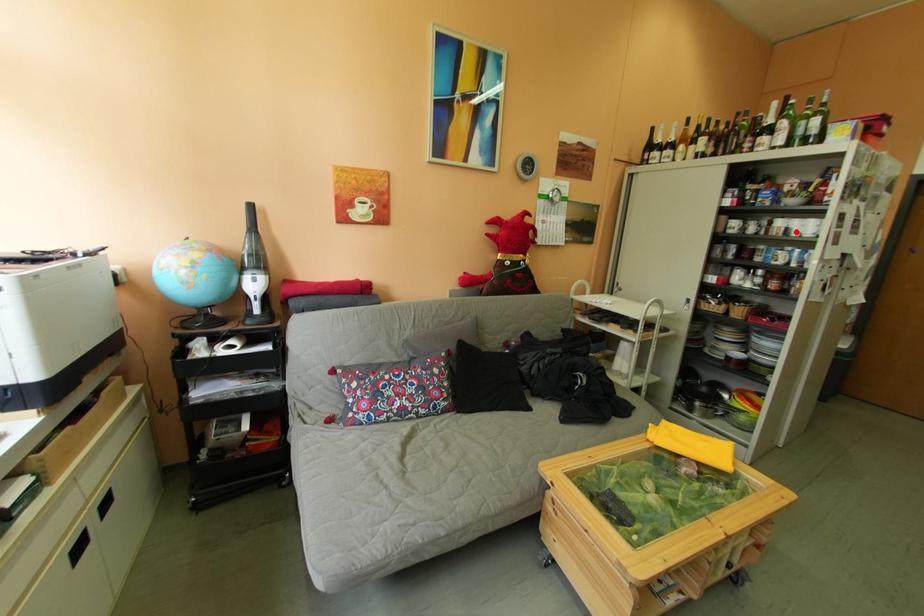
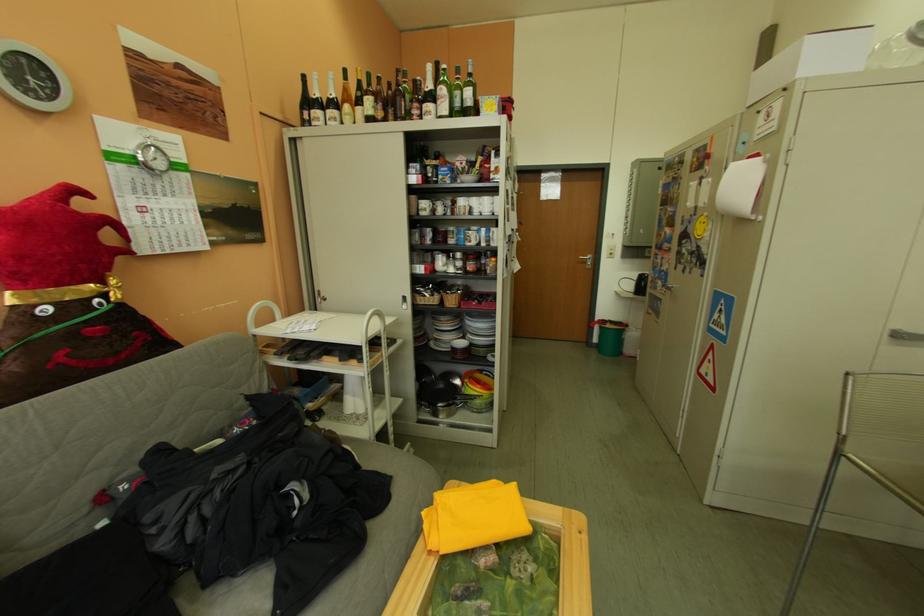
Question: A red point is marked in image1. In image2, is the corresponding 3D point closer to the camera or farther? Reply with the corresponding letter.

Choices:
 (A) The corresponding 3D point is closer.
 (B) The corresponding 3D point is farther.

Answer: (A)